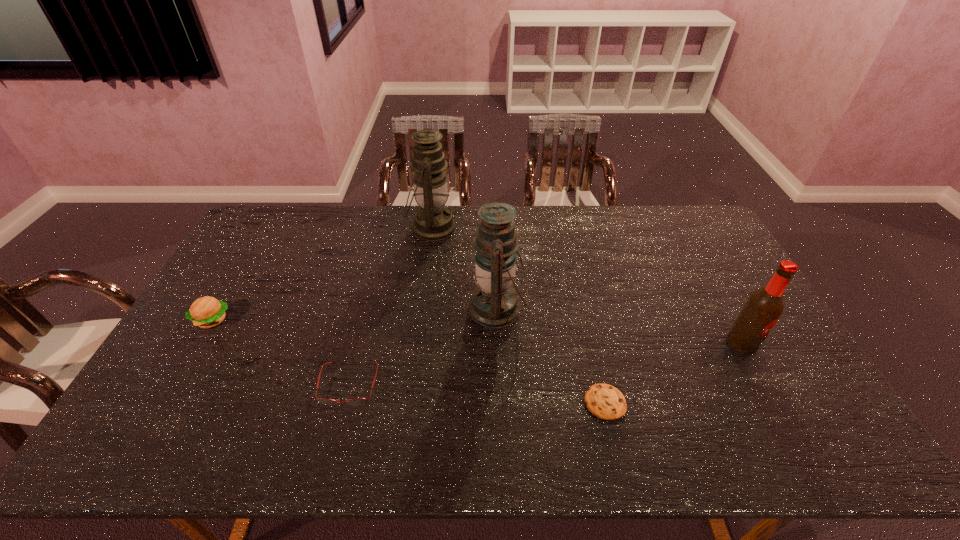
Find the location of `the left oil lamp`. the left oil lamp is located at coordinates (433, 221).

Identify the location of the farthest object. (433, 221).

Where is `the fourth object from left to right`? The width and height of the screenshot is (960, 540). the fourth object from left to right is located at coordinates (494, 304).

You are a GUI agent. You are given a task and a screenshot of the screen. Output one action in this format:
    pyautogui.click(x=<x>, y=<y>)
    Task: Click on the nearer oil lamp
    The height and width of the screenshot is (540, 960).
    Given the screenshot: What is the action you would take?
    pyautogui.click(x=494, y=304)

Where is `beer bottle`? beer bottle is located at coordinates (765, 305).

This screenshot has height=540, width=960. Find the location of `the rightmost object`. the rightmost object is located at coordinates (765, 305).

Locate an element on the screen. The image size is (960, 540). hamburger is located at coordinates (206, 312).

In order to click on the fourth tallest object in this screenshot , I will do `click(206, 312)`.

The width and height of the screenshot is (960, 540). Find the location of `the fifth tallest object`. the fifth tallest object is located at coordinates (357, 401).

Where is `the shortest object`? The image size is (960, 540). the shortest object is located at coordinates (606, 402).